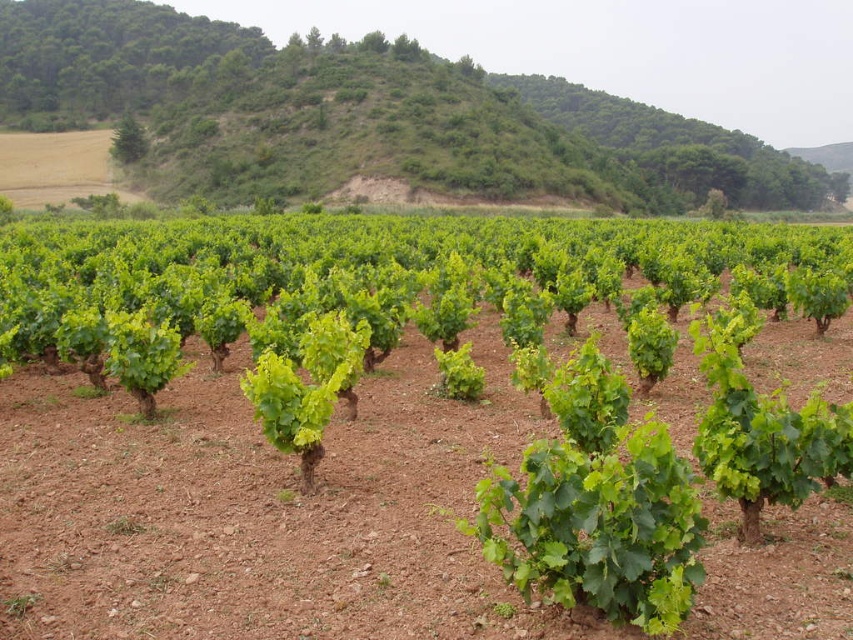
You are a gardener planning to plant new grapevines in the vineyard. You notice the green leafy vines at center and the green leafy hillside at upper center. Which area has more space available for planting new vines?

The green leafy hillside at upper center has more space available because it occupies more area than the green leafy vines at center.

You are a vineyard worker who needs to reach the green leafy hillside at upper center from the green leafy vines at center. The tractor you drive has a maximum range of 300 feet. Can you reach the hillside without needing to refuel?

The green leafy vines at center is 293.06 feet from the green leafy hillside at upper center. Since the tractor can travel up to 300 feet on a full tank, you can reach the hillside without needing to refuel.

You are a drone operator tasked with mapping the vineyard. The coordinates of the green leafy vines at center are given as point 0.691, 0.339. If you need to plant a new row of grapevines 2 meters north of this point, where would you mark the location?

The new row should be marked 2 meters north of the green leafy vines at center at point (288, 442).